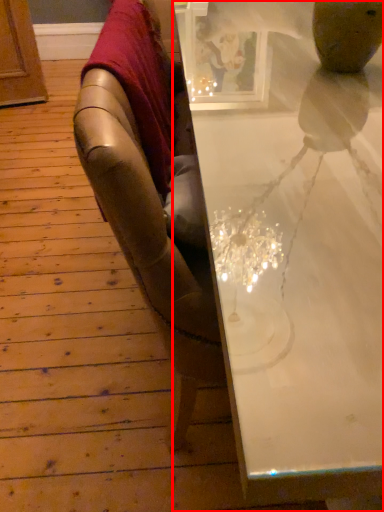
Question: From the image, what is the correct spatial relationship of table (annotated by the red box) in relation to blanket?

Choices:
 (A) left
 (B) right

Answer: (B)